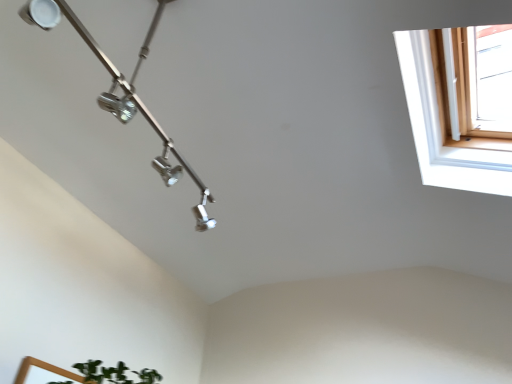
Question: Is white wooden window at upper right inside metallic track lighting at upper left?

Choices:
 (A) yes
 (B) no

Answer: (B)

Question: From the image's perspective, is metallic track lighting at upper left under white wooden window at upper right?

Choices:
 (A) no
 (B) yes

Answer: (B)

Question: Is white wooden window at upper right at the back of metallic track lighting at upper left?

Choices:
 (A) no
 (B) yes

Answer: (A)

Question: Does metallic track lighting at upper left have a smaller size compared to white wooden window at upper right?

Choices:
 (A) no
 (B) yes

Answer: (B)

Question: From a real-world perspective, is metallic track lighting at upper left under white wooden window at upper right?

Choices:
 (A) yes
 (B) no

Answer: (A)

Question: Is metallic track lighting at upper left aimed at white wooden window at upper right?

Choices:
 (A) no
 (B) yes

Answer: (B)

Question: Does white wooden window at upper right have a larger size compared to metallic track lighting at upper left?

Choices:
 (A) no
 (B) yes

Answer: (B)

Question: Does white wooden window at upper right have a lesser height compared to metallic track lighting at upper left?

Choices:
 (A) yes
 (B) no

Answer: (A)

Question: From a real-world perspective, is white wooden window at upper right physically above metallic track lighting at upper left?

Choices:
 (A) yes
 (B) no

Answer: (A)

Question: Is white wooden window at upper right thinner than metallic track lighting at upper left?

Choices:
 (A) no
 (B) yes

Answer: (A)

Question: Is white wooden window at upper right completely or partially outside of metallic track lighting at upper left?

Choices:
 (A) yes
 (B) no

Answer: (A)

Question: Does white wooden window at upper right come in front of metallic track lighting at upper left?

Choices:
 (A) no
 (B) yes

Answer: (A)

Question: Visually, is white wooden window at upper right positioned to the left or to the right of metallic track lighting at upper left?

Choices:
 (A) left
 (B) right

Answer: (B)